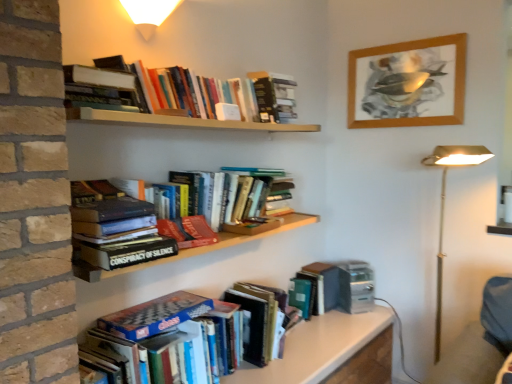
Identify the location of vacant space in front of green matte book at lower center, which is counted as the second book, starting from the bottom. This screenshot has height=384, width=512. (325, 330).